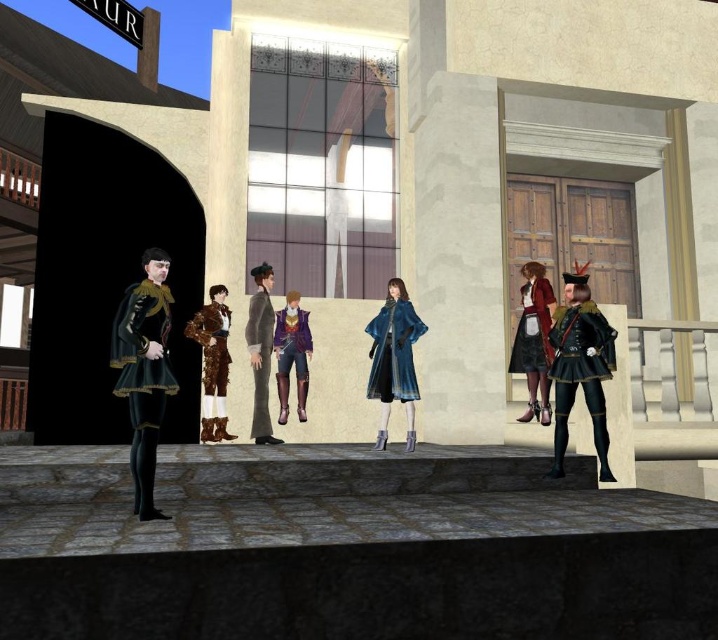
Question: Which of the following is the closest to the observer?

Choices:
 (A) shiny gold armor at center
 (B) shiny gold armor at right
 (C) gray fabric suit at center

Answer: (B)

Question: Which of the following is the farthest from the observer?

Choices:
 (A) (372, 333)
 (B) (271, 323)

Answer: (B)

Question: Among these points, which one is nearest to the camera?

Choices:
 (A) (126, 342)
 (B) (219, 340)

Answer: (A)

Question: Considering the relative positions of velvet black cape at left and gray fabric suit at center in the image provided, where is velvet black cape at left located with respect to gray fabric suit at center?

Choices:
 (A) above
 (B) below

Answer: (A)

Question: Can you confirm if matte red skirt at right is wider than gray fabric suit at center?

Choices:
 (A) yes
 (B) no

Answer: (A)

Question: Is shiny gold armor at right above leather jacket at center?

Choices:
 (A) yes
 (B) no

Answer: (A)